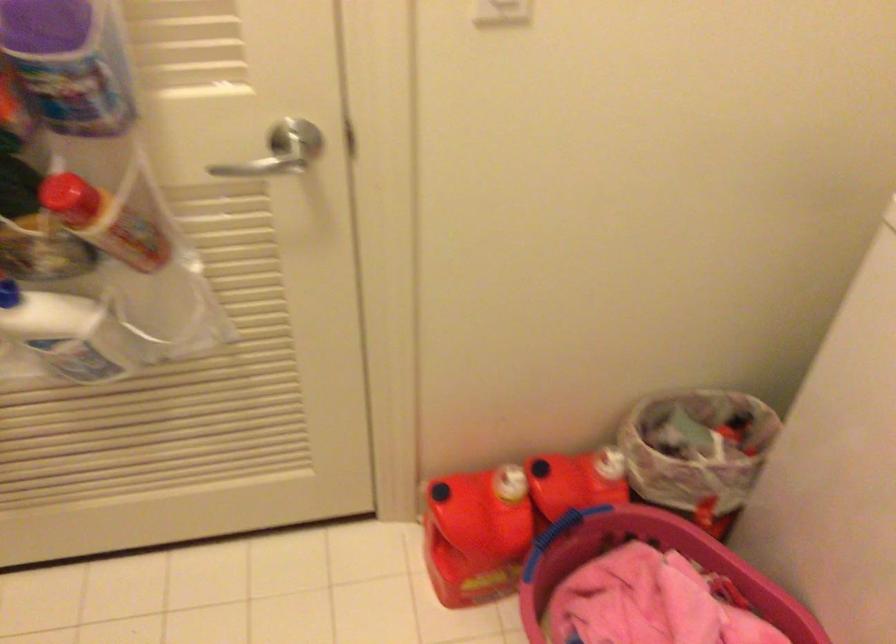
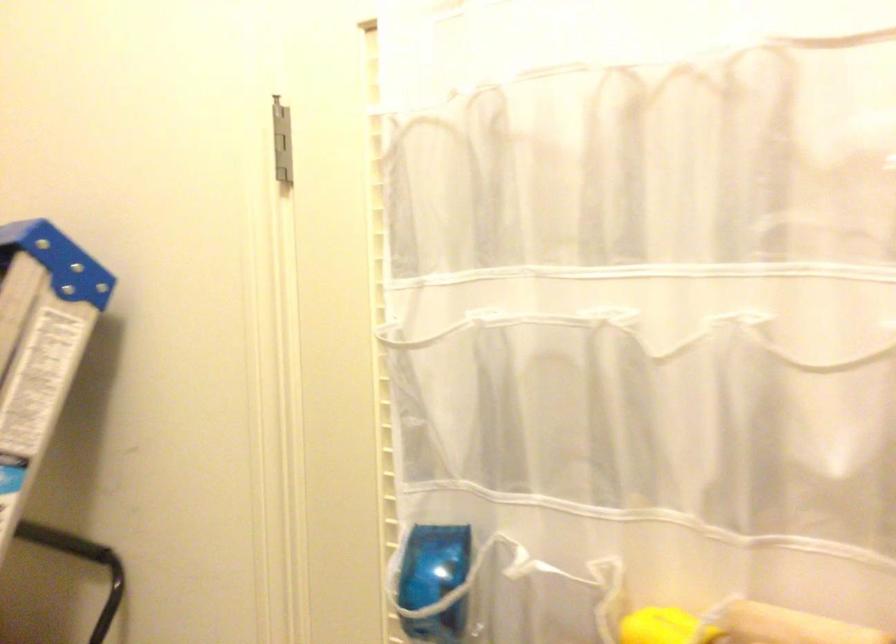
The first image is from the beginning of the video and the second image is from the end. How did the camera likely rotate when shooting the video?

The rotation direction of the camera is left-up.